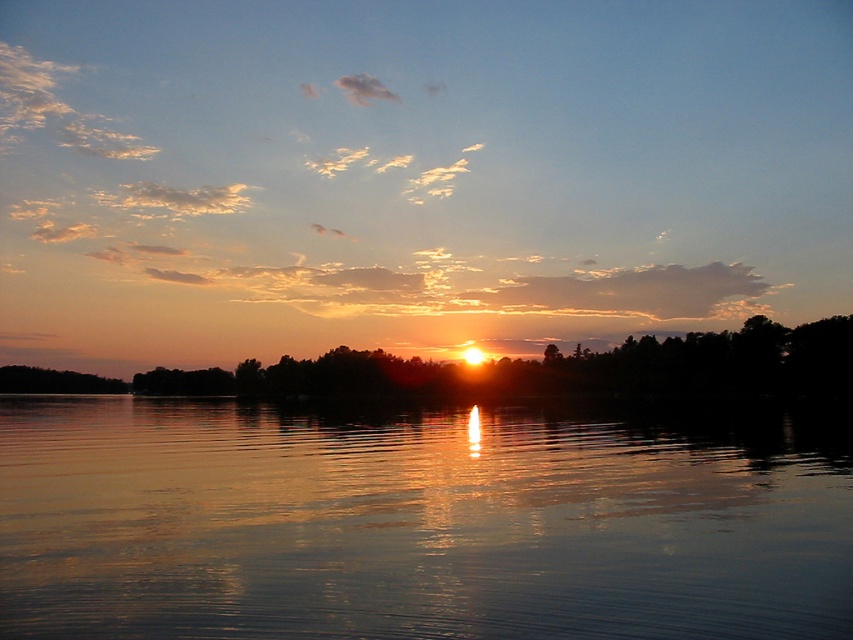
Question: Which object is positioned farthest from the silky black trees at center?

Choices:
 (A) glistening water at center
 (B) reflective water surface at center

Answer: (B)

Question: Is reflective water surface at center further to camera compared to glistening water at center?

Choices:
 (A) yes
 (B) no

Answer: (A)

Question: Is glistening water at center smaller than silky black trees at center?

Choices:
 (A) yes
 (B) no

Answer: (A)

Question: Which point appears closest to the camera in this image?

Choices:
 (A) (741, 394)
 (B) (527, 552)
 (C) (720, 154)

Answer: (B)

Question: Is reflective water surface at center below glistening water at center?

Choices:
 (A) yes
 (B) no

Answer: (B)

Question: Which is nearer to the glistening water at center?

Choices:
 (A) silky black trees at center
 (B) reflective water surface at center

Answer: (A)